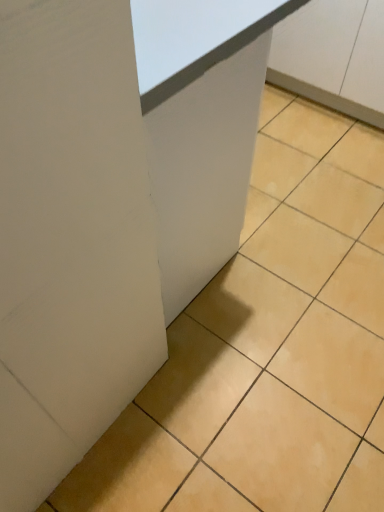
Question: Would you say white matte cabinet at center is to the left or to the right of white matte cabinet at upper right in the picture?

Choices:
 (A) left
 (B) right

Answer: (A)

Question: From their relative heights in the image, would you say white matte cabinet at center is taller or shorter than white matte cabinet at upper right?

Choices:
 (A) tall
 (B) short

Answer: (A)

Question: From a real-world perspective, is white matte cabinet at center positioned above or below white matte cabinet at upper right?

Choices:
 (A) above
 (B) below

Answer: (A)

Question: From a real-world perspective, is white matte cabinet at upper right physically located above or below white matte cabinet at center?

Choices:
 (A) above
 (B) below

Answer: (B)

Question: Which is correct: white matte cabinet at upper right is inside white matte cabinet at center, or outside of it?

Choices:
 (A) outside
 (B) inside

Answer: (A)

Question: Visually, is white matte cabinet at upper right positioned to the left or to the right of white matte cabinet at center?

Choices:
 (A) right
 (B) left

Answer: (A)

Question: Is point (365, 8) positioned closer to the camera than point (180, 257)?

Choices:
 (A) closer
 (B) farther

Answer: (B)